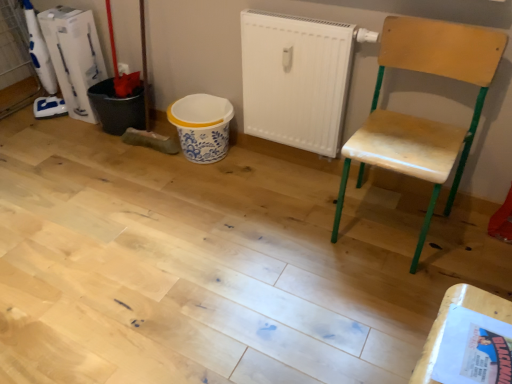
Question: Is wooden table at lower right to the left or to the right of wooden chair at right in the image?

Choices:
 (A) left
 (B) right

Answer: (A)

Question: Is wooden table at lower right taller or shorter than wooden chair at right?

Choices:
 (A) tall
 (B) short

Answer: (B)

Question: Which object is the closest to the wooden chair at right?

Choices:
 (A) white plastic bucket at left
 (B) white matte radiator at center
 (C) wooden table at lower right

Answer: (B)

Question: Estimate the real-world distances between objects in this image. Which object is farther from the wooden chair at right?

Choices:
 (A) white plastic bucket at left
 (B) wooden table at lower right
 (C) white matte radiator at center

Answer: (A)